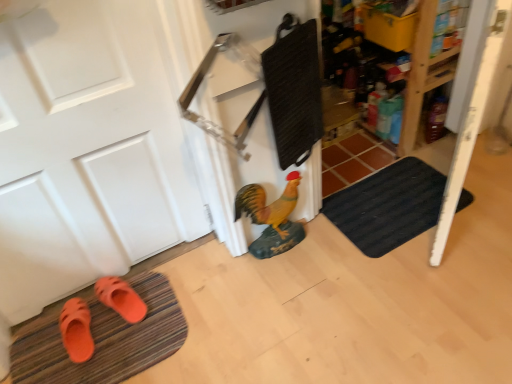
Locate an element on the screen. vacant space to the left of shiny yellow chicken at center is located at coordinates (220, 267).